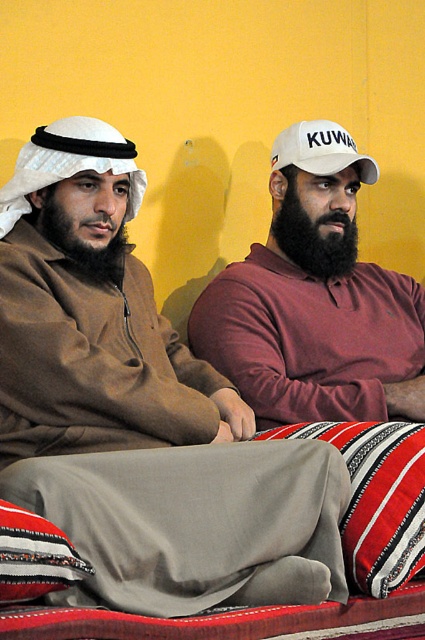
You are a photographer standing at the scene. You want to place a 3 feet wide banner between you and the striped fabric pillow at lower left. Will the banner fit without overlapping the pillow?

The distance between the striped fabric pillow at lower left and the viewer is 5.76 feet. Since the banner is 3 feet wide, there is enough space between you and the pillow to place it without overlapping.

You are an interior designer planning to place a new sofa in the living room where the maroon cotton shirt at center and striped fabric pillow at lower left are currently located. If the sofa will be placed between these two items, which item will be to the left of the sofa?

A: The striped fabric pillow at lower left will be to the left of the sofa because the maroon cotton shirt at center is positioned on the right side of the striped fabric pillow at lower left.

Looking at this image, you are a photographer setting up a portrait session. You want to ensure that both the maroon cotton shirt at center and the white fabric baseball cap at upper right are clearly visible in the frame. Given their sizes, which object should you focus on first to ensure proper exposure?

The maroon cotton shirt at center has a larger size compared to the white fabric baseball cap at upper right, so you should focus on the maroon cotton shirt at center first to ensure proper exposure since larger objects require more attention to capture details accurately.